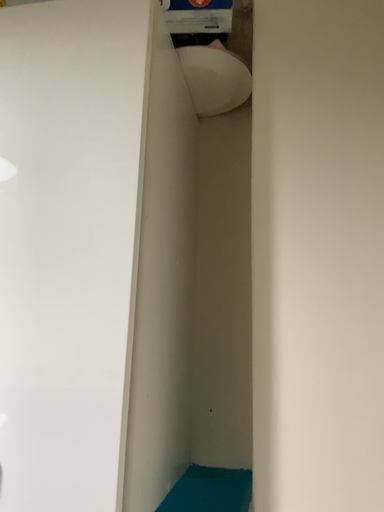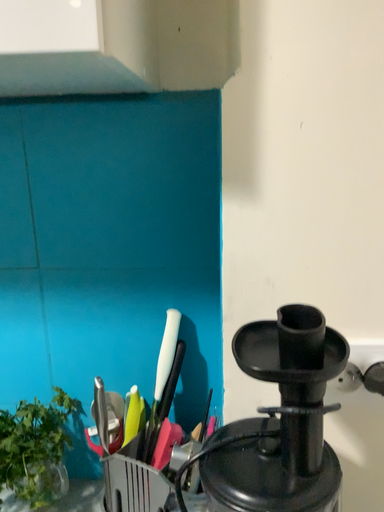
Question: Which way did the camera rotate in the video?

Choices:
 (A) rotated upward
 (B) rotated downward

Answer: (B)